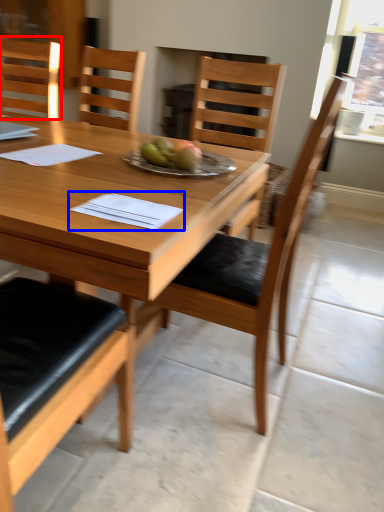
Question: Among these objects, which one is nearest to the camera, chair (highlighted by a red box) or notebook (highlighted by a blue box)?

Choices:
 (A) chair
 (B) notebook

Answer: (B)